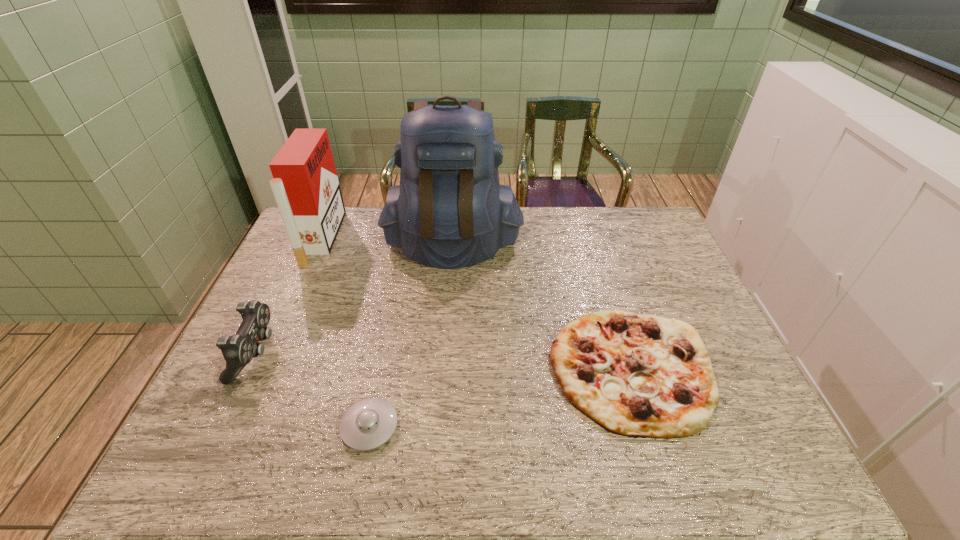
Identify the location of backpack at the far edge. (449, 211).

The image size is (960, 540). Identify the location of cigarette case that is at the far edge. (306, 188).

What are the coordinates of `pizza that is positioned at the near edge` in the screenshot? It's located at (634, 375).

Find the location of a particular element. The width and height of the screenshot is (960, 540). saucer at the near edge is located at coordinates pyautogui.click(x=368, y=424).

This screenshot has width=960, height=540. What are the coordinates of `cigarette case situated at the left edge` in the screenshot? It's located at (306, 188).

Locate an element on the screen. The width and height of the screenshot is (960, 540). control at the left edge is located at coordinates coord(238,350).

Where is `object that is positioned at the right edge`? The height and width of the screenshot is (540, 960). object that is positioned at the right edge is located at coordinates (634, 375).

Locate an element on the screen. This screenshot has width=960, height=540. object present at the far left corner is located at coordinates (306, 188).

The height and width of the screenshot is (540, 960). In order to click on object present at the near right corner in this screenshot , I will do `click(634, 375)`.

In the image, there is a desktop. Where is `free region at the far edge`? The height and width of the screenshot is (540, 960). free region at the far edge is located at coordinates (559, 235).